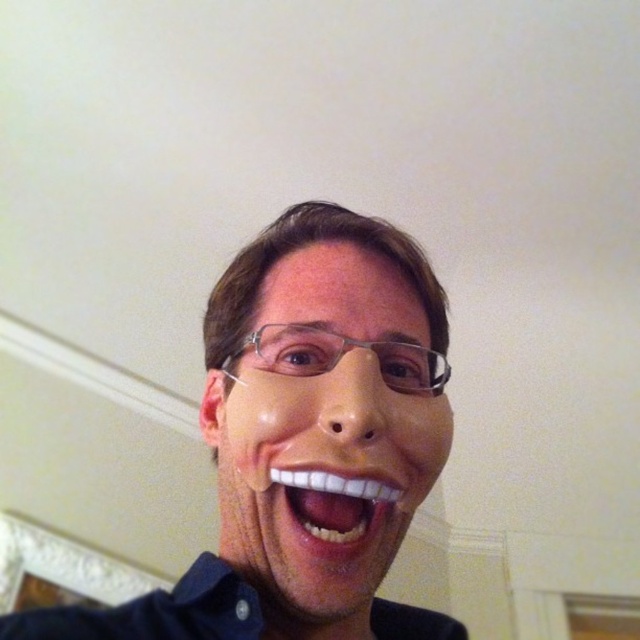
You are a photographer setting up for a portrait session. You notice two masks in the scene, a matte plastic mask at center and a transparent plastic mask at center. Which mask is positioned lower in the frame?

The matte plastic mask at center is located below the transparent plastic mask at center, so it is positioned lower in the frame.

From the picture: You are a dentist examining a patient. You notice the matte plastic mask at center and the white glossy teeth at center. Which object is positioned to the right of the other?

The matte plastic mask at center is to the right of white glossy teeth at center.

You are a dentist examining a patient. You notice the matte plastic mask at center and the white glossy teeth at center in the image. Which object is larger in height?

The matte plastic mask at center is much taller than the white glossy teeth at center.